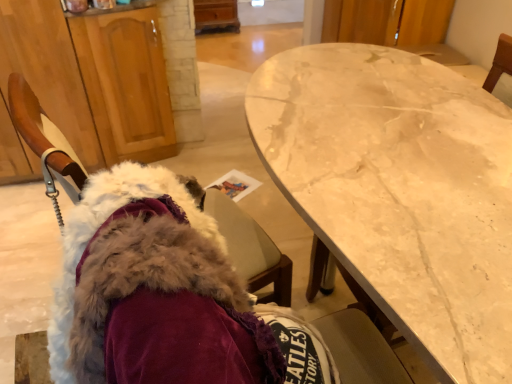
Question: Could you tell me if fuzzy fabric chair at left is turned towards wooden cabinet at left?

Choices:
 (A) yes
 (B) no

Answer: (A)

Question: Is fuzzy fabric chair at left outside of wooden cabinet at left?

Choices:
 (A) no
 (B) yes

Answer: (B)

Question: Is wooden cabinet at left inside fuzzy fabric chair at left?

Choices:
 (A) yes
 (B) no

Answer: (B)

Question: Is fuzzy fabric chair at left bigger than wooden cabinet at left?

Choices:
 (A) yes
 (B) no

Answer: (B)

Question: Considering the relative positions of fuzzy fabric chair at left and wooden cabinet at left in the image provided, is fuzzy fabric chair at left to the right of wooden cabinet at left from the viewer's perspective?

Choices:
 (A) yes
 (B) no

Answer: (A)

Question: Does fuzzy fabric chair at left have a greater height compared to wooden cabinet at left?

Choices:
 (A) yes
 (B) no

Answer: (B)

Question: Is white marble table at center positioned in front of fuzzy fabric chair at left?

Choices:
 (A) yes
 (B) no

Answer: (B)

Question: Is fuzzy fabric chair at left surrounded by white marble table at center?

Choices:
 (A) no
 (B) yes

Answer: (A)

Question: Is white marble table at center to the right of fuzzy fabric chair at left from the viewer's perspective?

Choices:
 (A) yes
 (B) no

Answer: (A)

Question: Does white marble table at center touch fuzzy fabric chair at left?

Choices:
 (A) no
 (B) yes

Answer: (A)

Question: From the image's perspective, is white marble table at center located above fuzzy fabric chair at left?

Choices:
 (A) yes
 (B) no

Answer: (A)

Question: Is white marble table at center oriented towards fuzzy fabric chair at left?

Choices:
 (A) no
 (B) yes

Answer: (B)

Question: From a real-world perspective, is wooden cabinet at left positioned over white marble table at center based on gravity?

Choices:
 (A) yes
 (B) no

Answer: (B)